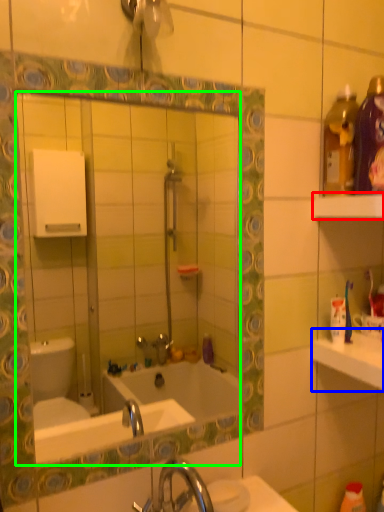
Question: Which object is positioned closest to shelf (highlighted by a red box)? Select from counter top (highlighted by a blue box) and mirror (highlighted by a green box).

Choices:
 (A) counter top
 (B) mirror

Answer: (A)